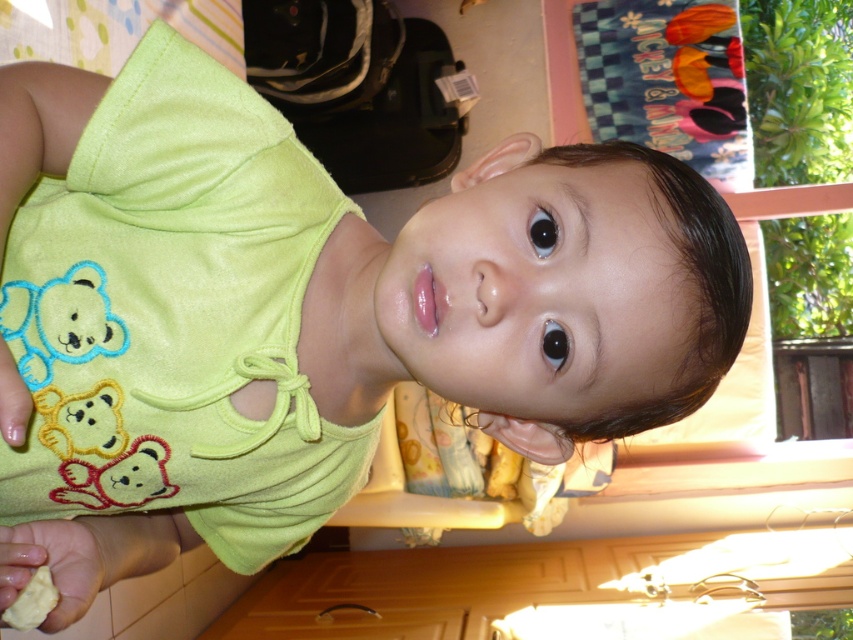
Question: Which of the following is the farthest from the observer?

Choices:
 (A) yellow matte cookie at lower left
 (B) yellow matte food at lower left

Answer: (A)

Question: Is yellow matte cookie at lower left thinner than yellow matte food at lower left?

Choices:
 (A) yes
 (B) no

Answer: (B)

Question: Which object appears farthest from the camera in this image?

Choices:
 (A) yellow matte food at lower left
 (B) yellow matte cookie at lower left

Answer: (B)

Question: Can you confirm if yellow matte cookie at lower left is thinner than yellow matte food at lower left?

Choices:
 (A) yes
 (B) no

Answer: (B)

Question: Is yellow matte cookie at lower left below yellow matte food at lower left?

Choices:
 (A) no
 (B) yes

Answer: (A)